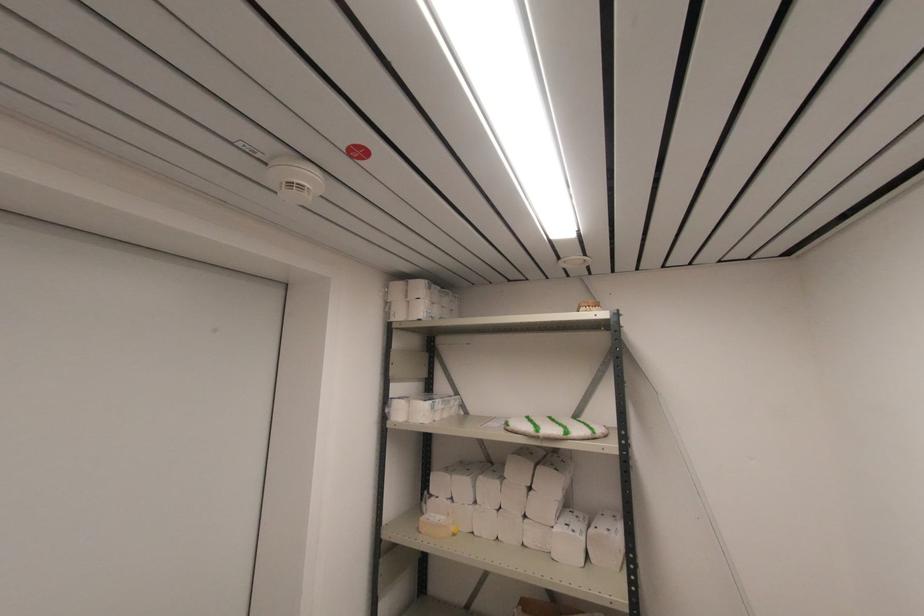
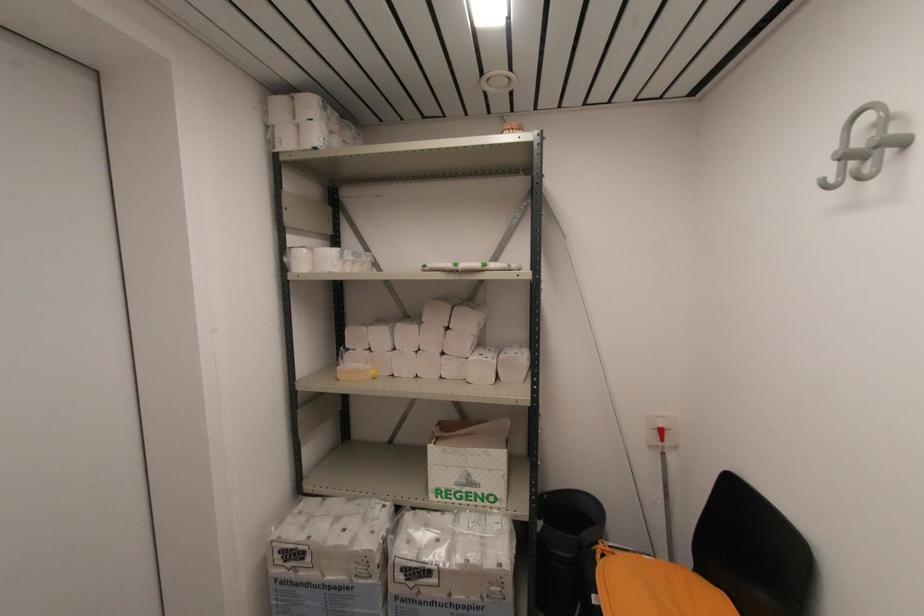
The first image is from the beginning of the video and the second image is from the end. How did the camera likely rotate when shooting the video?

The camera rotated toward right-down.